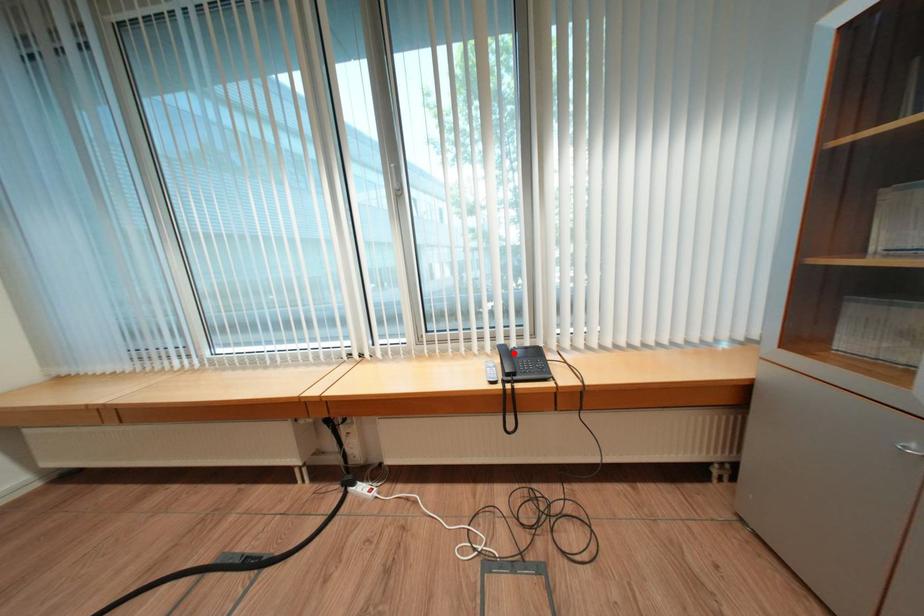
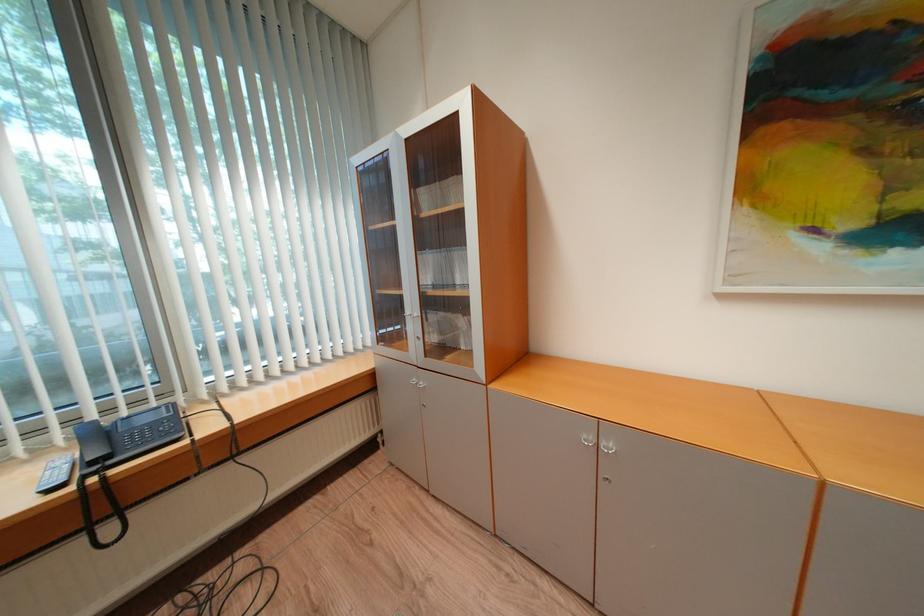
The point at the highlighted location is marked in the first image. Where is the corresponding point in the second image?

(104, 434)